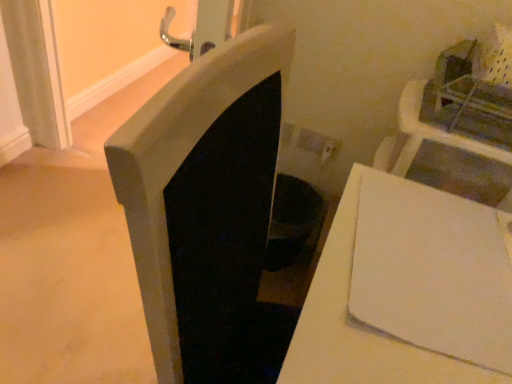
What do you see at coordinates (204, 204) in the screenshot? The height and width of the screenshot is (384, 512). I see `black matte fireplace at center` at bounding box center [204, 204].

Identify the location of black matte fireplace at center. The height and width of the screenshot is (384, 512). (204, 204).

The image size is (512, 384). I want to click on white matte table at lower right, so click(x=358, y=327).

What do you see at coordinates (358, 327) in the screenshot? This screenshot has width=512, height=384. I see `white matte table at lower right` at bounding box center [358, 327].

You are a GUI agent. You are given a task and a screenshot of the screen. Output one action in this format:
    pyautogui.click(x=<x>, y=<y>)
    Task: Click on the black matte fireplace at center
    The width and height of the screenshot is (512, 384).
    Given the screenshot: What is the action you would take?
    pyautogui.click(x=204, y=204)

Considering the positions of objects white matte table at lower right and black matte fireplace at center in the image provided, who is more to the right, white matte table at lower right or black matte fireplace at center?

white matte table at lower right.

Which object is further away from the camera, white matte table at lower right or black matte fireplace at center?

black matte fireplace at center is behind.

Is point (352, 349) behind point (112, 170)?

Yes, it is.

From the image's perspective, is white matte table at lower right positioned above or below black matte fireplace at center?

From the image's perspective, white matte table at lower right appears below black matte fireplace at center.

From a real-world perspective, is white matte table at lower right located higher than black matte fireplace at center?

No, from a real-world perspective, white matte table at lower right is not above black matte fireplace at center.

Consider the image. Considering the sizes of white matte table at lower right and black matte fireplace at center in the image, is white matte table at lower right wider or thinner than black matte fireplace at center?

Considering their sizes, white matte table at lower right looks broader than black matte fireplace at center.

Considering the sizes of objects white matte table at lower right and black matte fireplace at center in the image provided, who is taller, white matte table at lower right or black matte fireplace at center?

black matte fireplace at center.

Can you confirm if white matte table at lower right is bigger than black matte fireplace at center?

Yes, white matte table at lower right is bigger than black matte fireplace at center.

Based on the photo, is white matte table at lower right inside the boundaries of black matte fireplace at center, or outside?

white matte table at lower right is not inside black matte fireplace at center, it's outside.

Is white matte table at lower right not near black matte fireplace at center?

No, white matte table at lower right is in close proximity to black matte fireplace at center.

Is white matte table at lower right facing away from black matte fireplace at center?

No, white matte table at lower right is not facing the opposite direction of black matte fireplace at center.

What's the angular difference between white matte table at lower right and black matte fireplace at center's facing directions?

The facing directions of white matte table at lower right and black matte fireplace at center are 19.9 degrees apart.

In the image, there is a white matte table at lower right. In order to click on fireplace above it (from the image's perspective) in this screenshot , I will do `click(204, 204)`.

Considering the relative positions of black matte fireplace at center and white matte table at lower right in the image provided, is black matte fireplace at center to the left of white matte table at lower right from the viewer's perspective?

Yes, black matte fireplace at center is to the left of white matte table at lower right.

Which is in front, black matte fireplace at center or white matte table at lower right?

Positioned in front is white matte table at lower right.

Is point (149, 292) farther from camera compared to point (353, 181)?

No, it is not.

From the image's perspective, which is above, black matte fireplace at center or white matte table at lower right?

black matte fireplace at center is shown above in the image.

From a real-world perspective, is black matte fireplace at center on top of white matte table at lower right?

Yes, from a real-world perspective, black matte fireplace at center is above white matte table at lower right.

Between black matte fireplace at center and white matte table at lower right, which one has smaller width?

Thinner between the two is black matte fireplace at center.

Who is taller, black matte fireplace at center or white matte table at lower right?

black matte fireplace at center.

Consider the image. Who is bigger, black matte fireplace at center or white matte table at lower right?

Bigger between the two is white matte table at lower right.

Is black matte fireplace at center positioned beyond the bounds of white matte table at lower right?

black matte fireplace at center lies outside white matte table at lower right's area.

Are black matte fireplace at center and white matte table at lower right beside each other?

They are not placed beside each other.

Could you tell me if black matte fireplace at center is turned towards white matte table at lower right?

No, black matte fireplace at center is not facing towards white matte table at lower right.

How far apart are black matte fireplace at center and white matte table at lower right?

The distance of black matte fireplace at center from white matte table at lower right is 8.88 inches.

The height and width of the screenshot is (384, 512). Find the location of `table that appears in front of the black matte fireplace at center`. table that appears in front of the black matte fireplace at center is located at coordinates (358, 327).

You are a GUI agent. You are given a task and a screenshot of the screen. Output one action in this format:
    pyautogui.click(x=<x>, y=<y>)
    Task: Click on the fireplace that is behind the white matte table at lower right
    
    Given the screenshot: What is the action you would take?
    pyautogui.click(x=204, y=204)

Locate an element on the screen. fireplace that appears above the white matte table at lower right (from the image's perspective) is located at coordinates (204, 204).